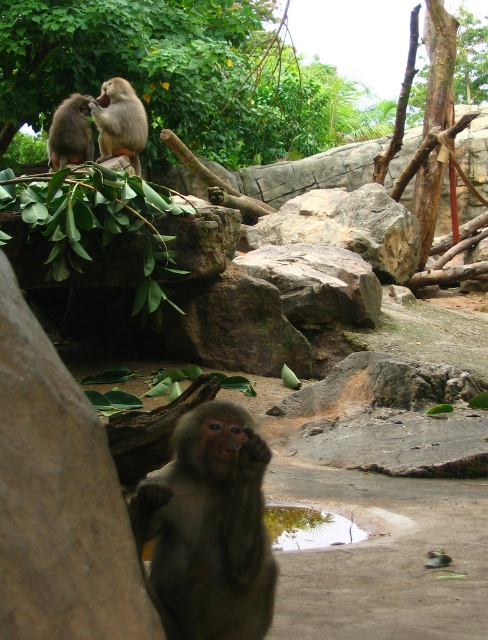
Based on the photo, who is positioned more to the left, green leafy tree at upper left or smooth gray monkey at center?

green leafy tree at upper left is more to the left.

Can you confirm if green leafy tree at upper left is thinner than smooth gray monkey at center?

No, green leafy tree at upper left is not thinner than smooth gray monkey at center.

Is point (169, 8) less distant than point (219, 429)?

No, (169, 8) is behind (219, 429).

Locate an element on the screen. The width and height of the screenshot is (488, 640). green leafy tree at upper left is located at coordinates (143, 65).

Between point (306, 513) and point (72, 161), which one is positioned behind?

The point (72, 161) is behind.

Between transparent glass puddle at lower center and gray furry monkey at upper left, which one appears on the right side from the viewer's perspective?

Positioned to the right is transparent glass puddle at lower center.

Is point (333, 516) farther from viewer compared to point (85, 131)?

No, it is in front of (85, 131).

Locate an element on the screen. transparent glass puddle at lower center is located at coordinates (307, 528).

Can you confirm if smooth gray monkey at center is smaller than transparent glass puddle at lower center?

Incorrect, smooth gray monkey at center is not smaller in size than transparent glass puddle at lower center.

Who is positioned more to the right, smooth gray monkey at center or transparent glass puddle at lower center?

Positioned to the right is transparent glass puddle at lower center.

At what (x,y) coordinates should I click in order to perform the action: click on smooth gray monkey at center. Please return your answer as a coordinate pair (x, y). Looking at the image, I should click on (208, 529).

In order to click on smooth gray monkey at center in this screenshot , I will do click(208, 529).